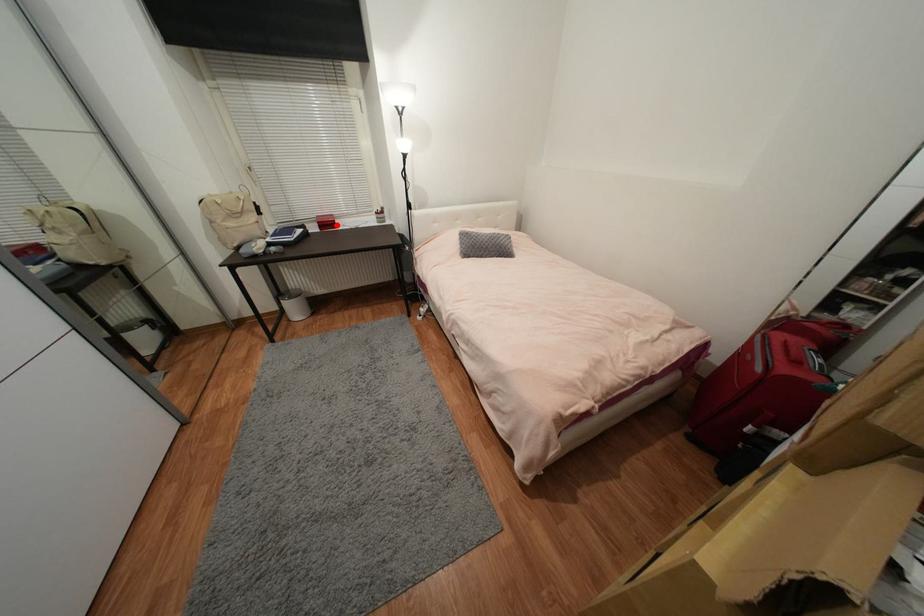
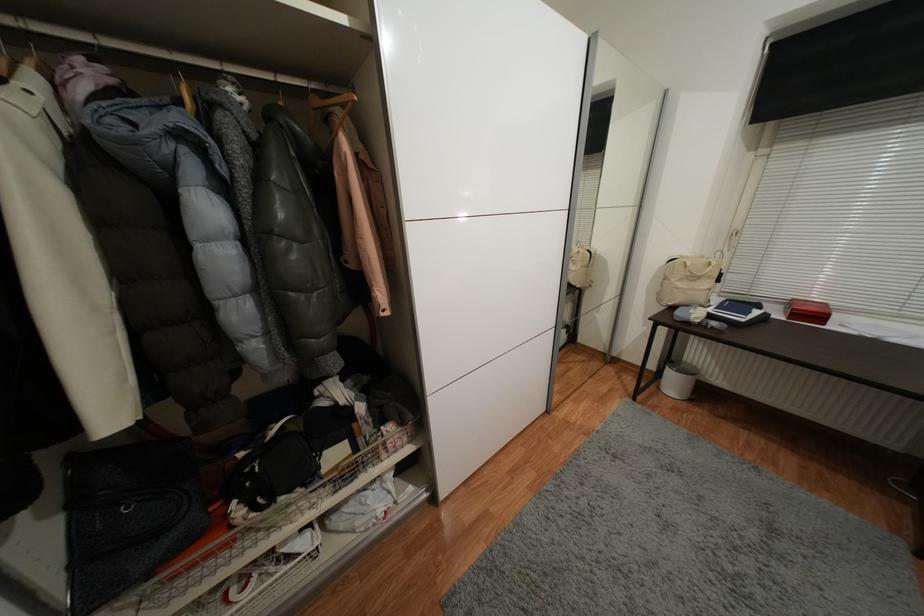
The point at the highlighted location is marked in the first image. Where is the corresponding point in the second image?

(824, 318)